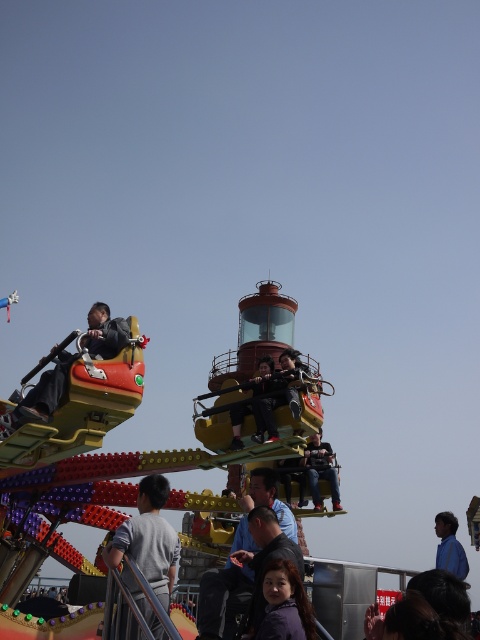
Question: Which of the following is the closest to the observer?

Choices:
 (A) (455, 516)
 (B) (297, 362)
 (C) (266, 388)

Answer: (C)

Question: Which object is closer to the camera taking this photo?

Choices:
 (A) matte black pants at center
 (B) denim jeans at center

Answer: (A)

Question: Can you confirm if blue shirt at lower right is positioned to the right of matte black helmet at center?

Choices:
 (A) no
 (B) yes

Answer: (B)

Question: Considering the real-world distances, which object is farthest from the denim jeans at center?

Choices:
 (A) gray cotton shirt at lower left
 (B) matte black pants at center
 (C) dark blue fabric jacket at center
 (D) matte black helmet at center

Answer: (A)

Question: Does gray cotton shirt at lower left have a lesser width compared to purple matte jacket at lower center?

Choices:
 (A) yes
 (B) no

Answer: (B)

Question: Where is purple matte jacket at lower center located in relation to matte black pants at center in the image?

Choices:
 (A) below
 (B) above

Answer: (A)